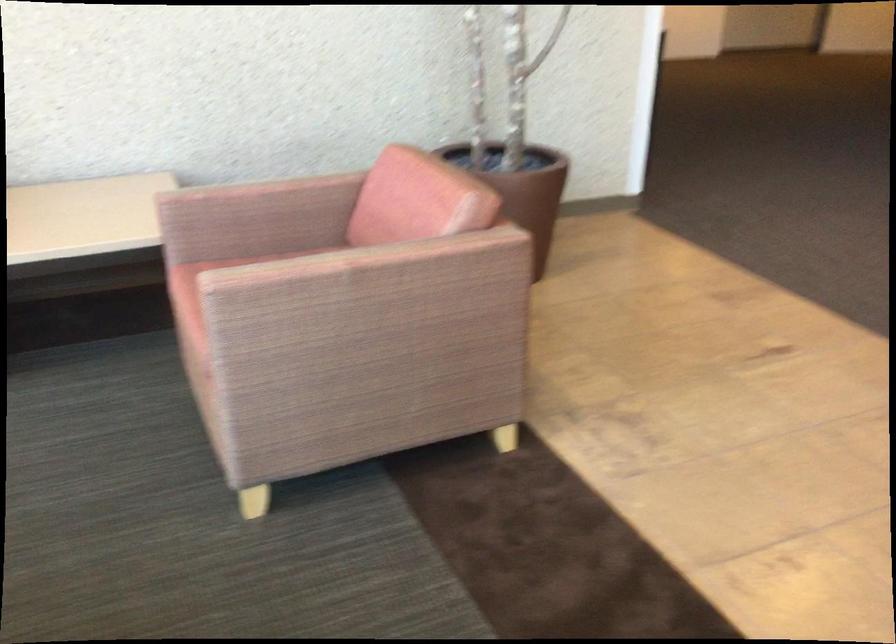
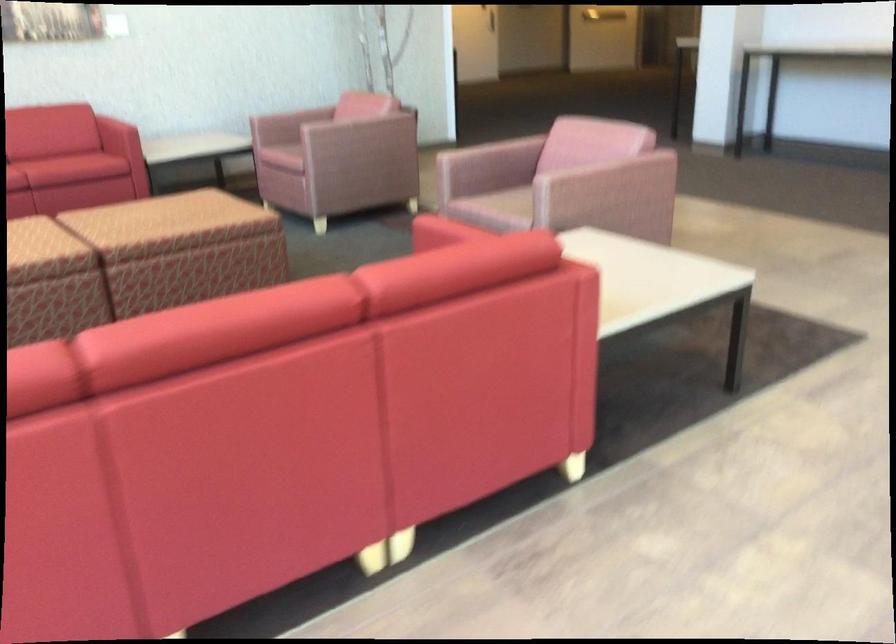
Question: Which direction would the cameraman need to move to produce the second image? Reply with the corresponding letter.

Choices:
 (A) Left
 (B) Right
 (C) Forward
 (D) Backward

Answer: (D)